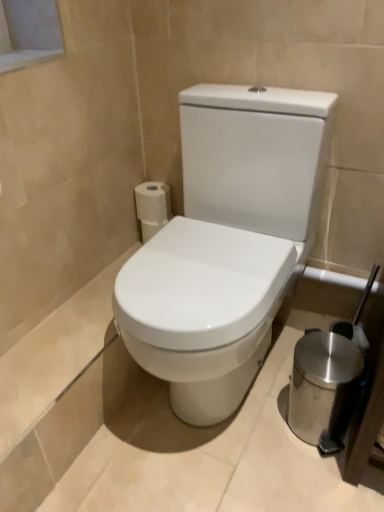
Question: From their relative heights in the image, would you say white glossy toilet at center is taller or shorter than polished stainless steel trash can at lower right?

Choices:
 (A) tall
 (B) short

Answer: (A)

Question: Looking at the image, does white glossy toilet at center seem bigger or smaller compared to polished stainless steel trash can at lower right?

Choices:
 (A) small
 (B) big

Answer: (B)

Question: Which is nearer to the white glossy toilet at center?

Choices:
 (A) polished stainless steel trash can at lower right
 (B) white matte toilet paper at upper left

Answer: (A)

Question: Which object is positioned farthest from the polished stainless steel trash can at lower right?

Choices:
 (A) white matte toilet paper at upper left
 (B) white glossy toilet at center

Answer: (A)